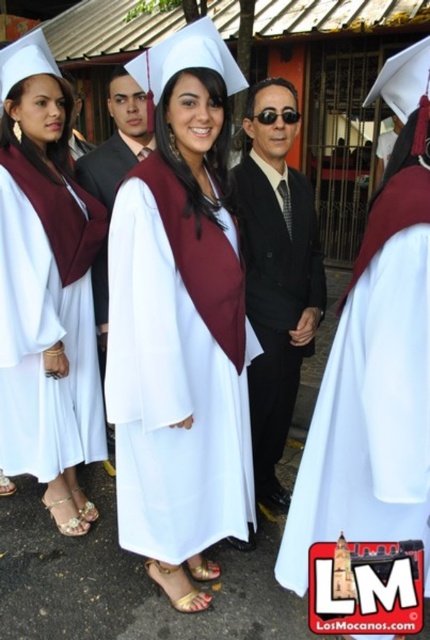
Question: Can you confirm if white matte graduation gown at center is positioned below black satin suit at center?

Choices:
 (A) no
 (B) yes

Answer: (B)

Question: Which point is farther to the camera?

Choices:
 (A) (429, 433)
 (B) (197, 225)

Answer: (B)

Question: Is white matte gown at center to the left of black satin suit at center from the viewer's perspective?

Choices:
 (A) no
 (B) yes

Answer: (A)

Question: Can you confirm if black satin suit at center is bigger than shiny black suit at center?

Choices:
 (A) yes
 (B) no

Answer: (A)

Question: Considering the real-world distances, which object is farthest from the shiny black suit at center?

Choices:
 (A) black satin suit at center
 (B) matte white gown at center
 (C) white matte graduation gown at center
 (D) white matte gown at center

Answer: (D)

Question: Among these objects, which one is farthest from the camera?

Choices:
 (A) matte white gown at center
 (B) white matte graduation gown at center

Answer: (A)